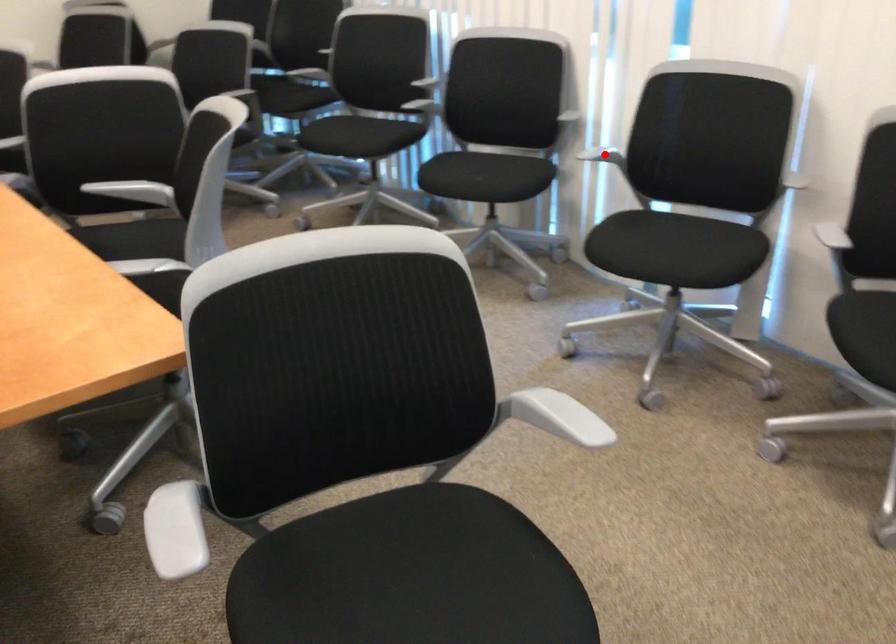
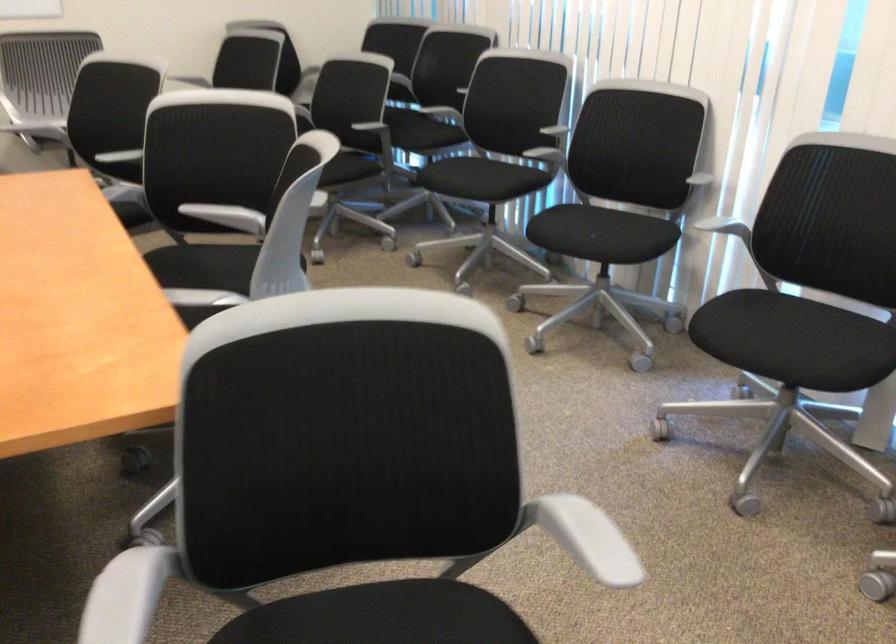
Locate, in the second image, the point that corresponds to the highlighted location in the first image.

(725, 228)